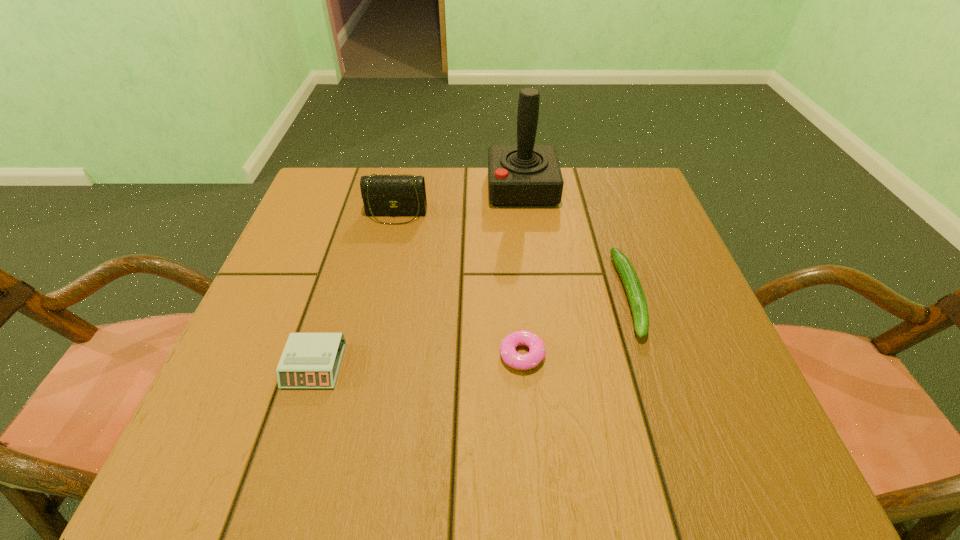
The width and height of the screenshot is (960, 540). I want to click on the tallest object, so click(524, 175).

Identify the location of clutch bag. (384, 195).

This screenshot has width=960, height=540. I want to click on alarm clock, so click(309, 360).

You are a GUI agent. You are given a task and a screenshot of the screen. Output one action in this format:
    pyautogui.click(x=<x>, y=<y>)
    Task: Click on the zucchini
    The image size is (960, 540).
    Given the screenshot: What is the action you would take?
    pyautogui.click(x=632, y=285)

Identify the location of doughnut. This screenshot has height=540, width=960. (537, 351).

Where is `vacant space located on the base of the joystick`? vacant space located on the base of the joystick is located at coordinates (407, 188).

Image resolution: width=960 pixels, height=540 pixels. In order to click on free location located 0.050m on the base of the joystick in this screenshot , I will do `click(468, 188)`.

The image size is (960, 540). I want to click on free region located on the base of the joystick, so click(x=415, y=188).

Where is `vacant position located 0.300m on the front flap of the fourth shortest object`? vacant position located 0.300m on the front flap of the fourth shortest object is located at coordinates (372, 325).

Where is `vacant space located on the right of the alarm clock`? The width and height of the screenshot is (960, 540). vacant space located on the right of the alarm clock is located at coordinates (404, 366).